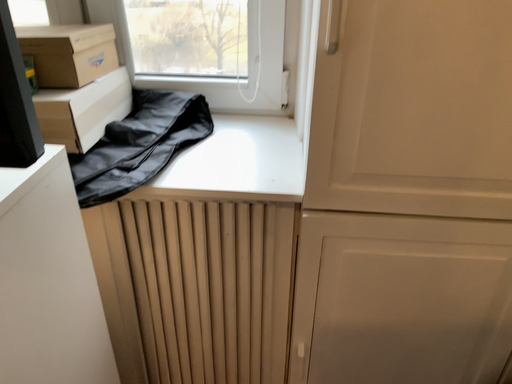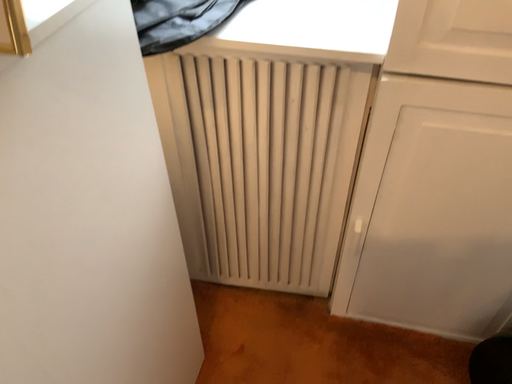
Question: How did the camera likely rotate when shooting the video?

Choices:
 (A) rotated right
 (B) rotated left

Answer: (B)